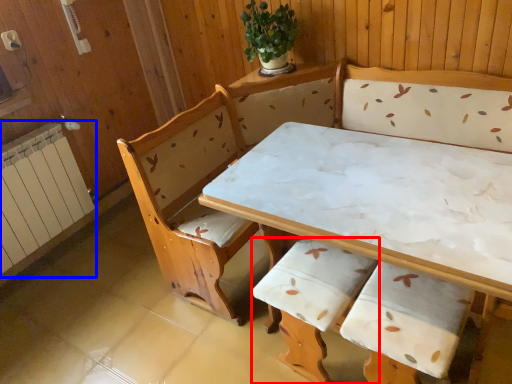
Question: Which of the following is the closest to the observer, armchair (highlighted by a red box) or radiator (highlighted by a blue box)?

Choices:
 (A) armchair
 (B) radiator

Answer: (A)